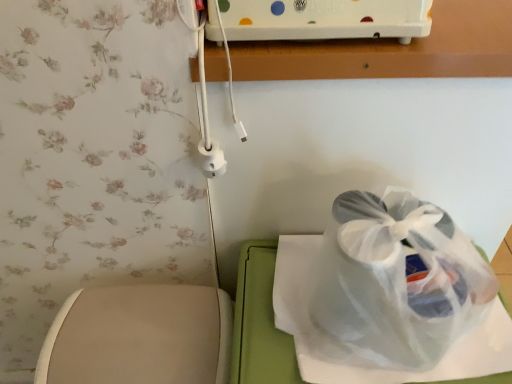
Question: Is the position of beige fabric toilet at lower left less distant than that of transparent plastic bag at center?

Choices:
 (A) yes
 (B) no

Answer: (B)

Question: Does beige fabric toilet at lower left have a lesser height compared to transparent plastic bag at center?

Choices:
 (A) no
 (B) yes

Answer: (A)

Question: Is the surface of beige fabric toilet at lower left in direct contact with transparent plastic bag at center?

Choices:
 (A) no
 (B) yes

Answer: (A)

Question: Is beige fabric toilet at lower left wider than transparent plastic bag at center?

Choices:
 (A) no
 (B) yes

Answer: (A)

Question: Does beige fabric toilet at lower left appear on the left side of transparent plastic bag at center?

Choices:
 (A) no
 (B) yes

Answer: (B)

Question: Is beige fabric toilet at lower left not close to transparent plastic bag at center?

Choices:
 (A) yes
 (B) no

Answer: (B)

Question: Does transparent plastic bag at center lie in front of beige fabric toilet at lower left?

Choices:
 (A) yes
 (B) no

Answer: (A)

Question: Is beige fabric toilet at lower left at the back of transparent plastic bag at center?

Choices:
 (A) yes
 (B) no

Answer: (B)

Question: From the image's perspective, is transparent plastic bag at center under beige fabric toilet at lower left?

Choices:
 (A) no
 (B) yes

Answer: (A)

Question: Is transparent plastic bag at center not within beige fabric toilet at lower left?

Choices:
 (A) yes
 (B) no

Answer: (A)

Question: From a real-world perspective, is transparent plastic bag at center positioned under beige fabric toilet at lower left based on gravity?

Choices:
 (A) yes
 (B) no

Answer: (B)

Question: Is transparent plastic bag at center to the left of beige fabric toilet at lower left from the viewer's perspective?

Choices:
 (A) no
 (B) yes

Answer: (A)

Question: Is beige fabric toilet at lower left bigger or smaller than transparent plastic bag at center?

Choices:
 (A) big
 (B) small

Answer: (A)